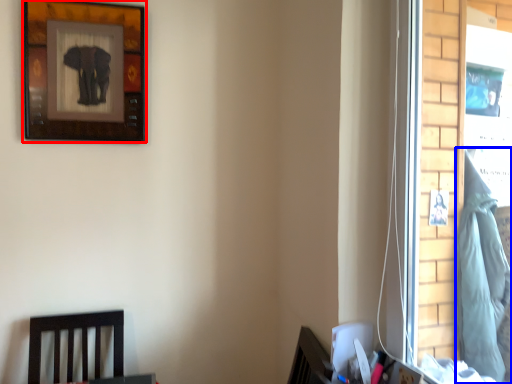
Question: Which of the following is the closest to the observer, picture frame (highlighted by a red box) or laundry (highlighted by a blue box)?

Choices:
 (A) picture frame
 (B) laundry

Answer: (A)